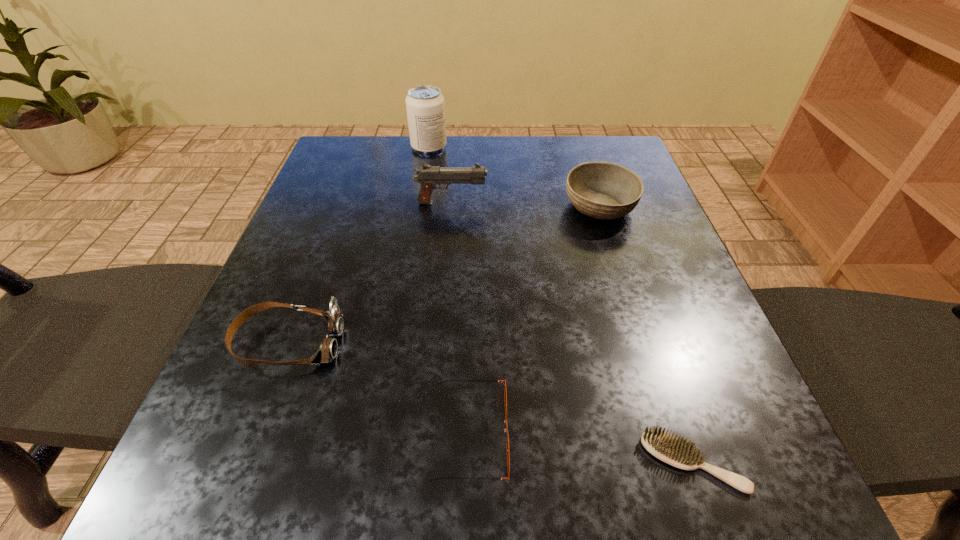
What are the coordinates of `free space between the fifth shortest object and the shortest object` in the screenshot? It's located at (572, 333).

The image size is (960, 540). I want to click on free space between the bowl and the farthest object, so click(515, 177).

You are a GUI agent. You are given a task and a screenshot of the screen. Output one action in this format:
    pyautogui.click(x=<x>, y=<y>)
    Task: Click on the free space between the bowl and the tallest object
    The height and width of the screenshot is (540, 960).
    Given the screenshot: What is the action you would take?
    pyautogui.click(x=515, y=177)

The image size is (960, 540). I want to click on vacant region between the farthest object and the shortest object, so click(x=561, y=305).

Identify the location of free spot between the tallest object and the third nearest object. (359, 245).

The height and width of the screenshot is (540, 960). I want to click on blank region between the gun and the third shortest object, so click(370, 273).

Locate an element on the screen. This screenshot has width=960, height=540. free spot between the fifth shortest object and the shortest object is located at coordinates (572, 333).

Locate an element on the screen. This screenshot has width=960, height=540. free space that is in between the third tallest object and the fifth shortest object is located at coordinates (525, 205).

Image resolution: width=960 pixels, height=540 pixels. Find the location of `the third closest object relative to the third tallest object`. the third closest object relative to the third tallest object is located at coordinates (502, 381).

You are a GUI agent. You are given a task and a screenshot of the screen. Output one action in this format:
    pyautogui.click(x=<x>, y=<y>)
    Task: Click on the object that is the fourth closest one to the third nearest object
    The width and height of the screenshot is (960, 540).
    Given the screenshot: What is the action you would take?
    pyautogui.click(x=603, y=190)